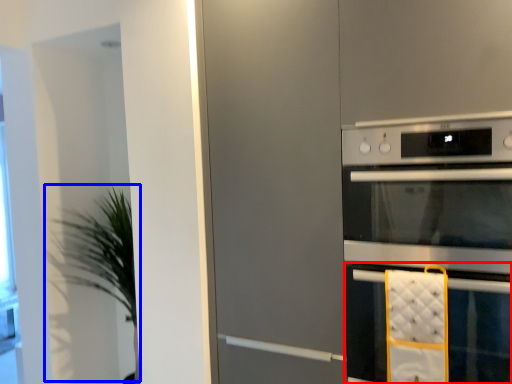
Question: Which object is closer to the camera taking this photo, oven (highlighted by a red box) or plant (highlighted by a blue box)?

Choices:
 (A) oven
 (B) plant

Answer: (A)